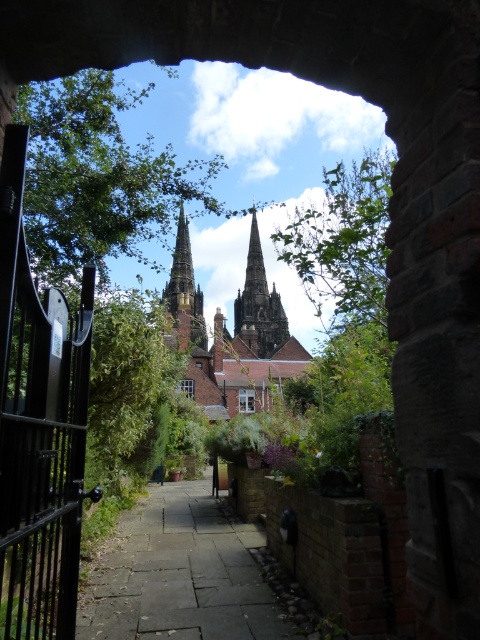
The height and width of the screenshot is (640, 480). What do you see at coordinates (180, 573) in the screenshot?
I see `gray stone path at center` at bounding box center [180, 573].

Is point (88, 582) more distant than point (267, 298)?

No, (88, 582) is closer to viewer.

At what (x,y) coordinates should I click in order to perform the action: click on gray stone path at center. Please return your answer as a coordinate pair (x, y). Looking at the image, I should click on (180, 573).

Can you confirm if black metal gate at left is wider than gray stone path at center?

Incorrect, black metal gate at left's width does not surpass gray stone path at center's.

The width and height of the screenshot is (480, 640). What do you see at coordinates (38, 426) in the screenshot?
I see `black metal gate at left` at bounding box center [38, 426].

Who is more distant from viewer, (67,420) or (126,636)?

The point (126,636) is behind.

This screenshot has width=480, height=640. I want to click on black metal gate at left, so click(x=38, y=426).

Is gray stone path at center taller than brown brick church at center?

No, gray stone path at center is not taller than brown brick church at center.

Does point (211, 552) come in front of point (249, 404)?

Yes, it is in front of point (249, 404).

Where is `gray stone path at center`? gray stone path at center is located at coordinates (180, 573).